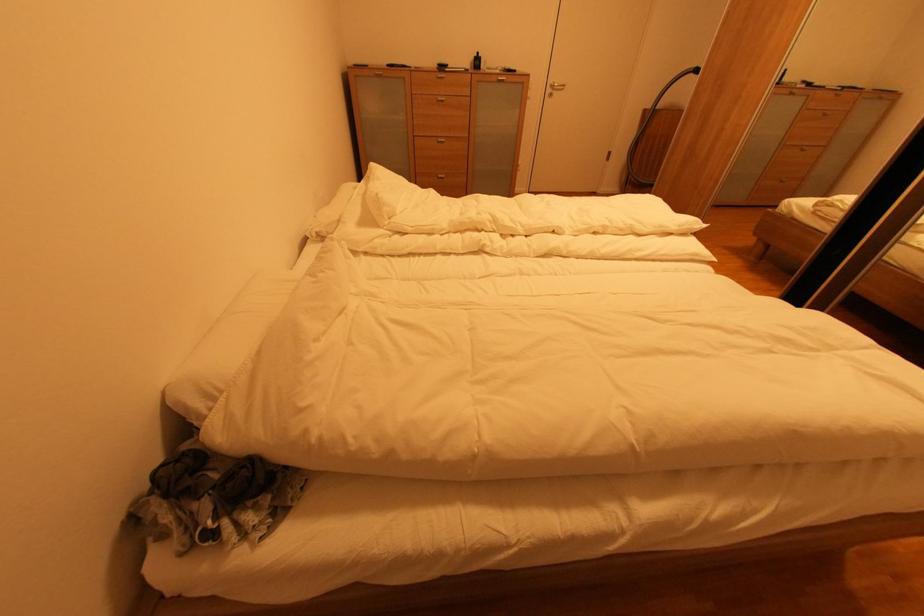
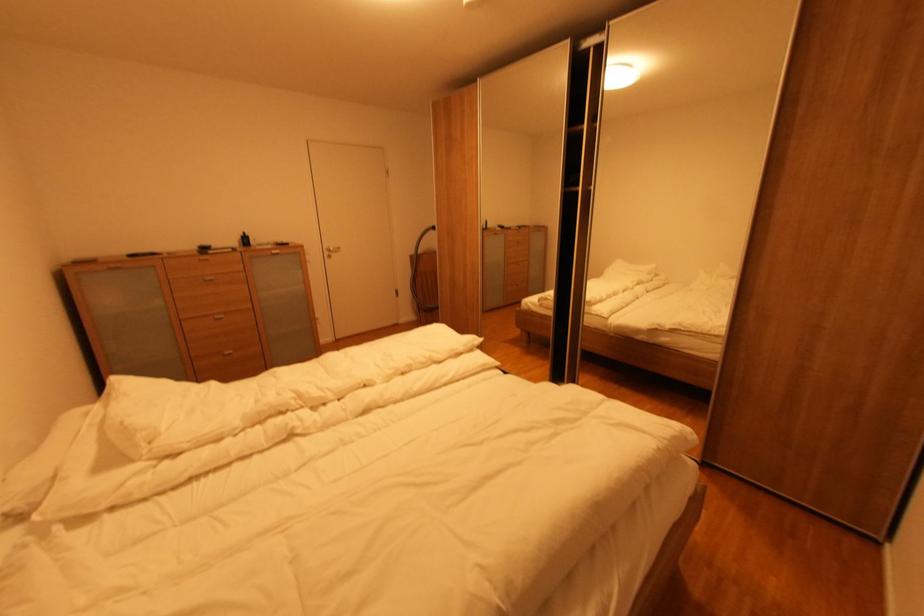
Find the pixel in the second image that matches (554,92) in the first image.

(333, 254)